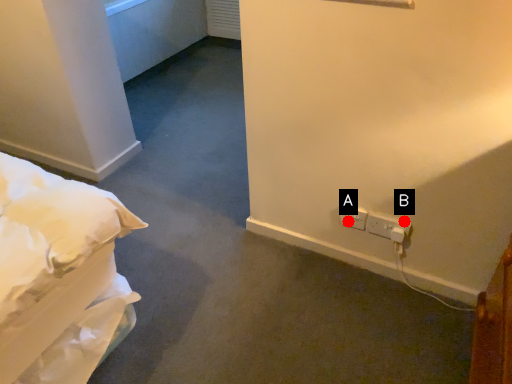
Question: Two points are circled on the image, labeled by A and B beside each circle. Among these points, which one is nearest to the camera?

Choices:
 (A) A is closer
 (B) B is closer

Answer: (B)